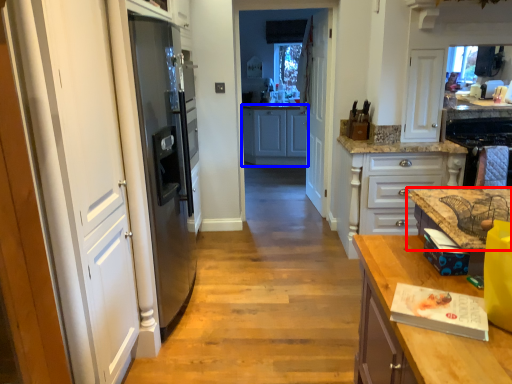
Question: Which of the following is the farthest to the observer, countertop (highlighted by a red box) or cabinetry (highlighted by a blue box)?

Choices:
 (A) countertop
 (B) cabinetry

Answer: (B)